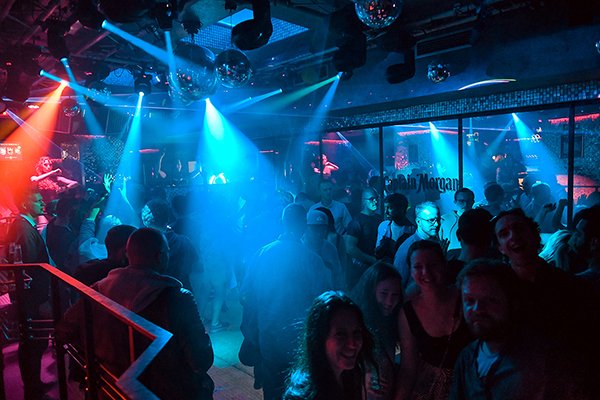
At what (x,y) coordinates should I click in order to perform the action: click on ceiling. Please return your answer as a coordinate pair (x, y). Looking at the image, I should click on pos(210,13).